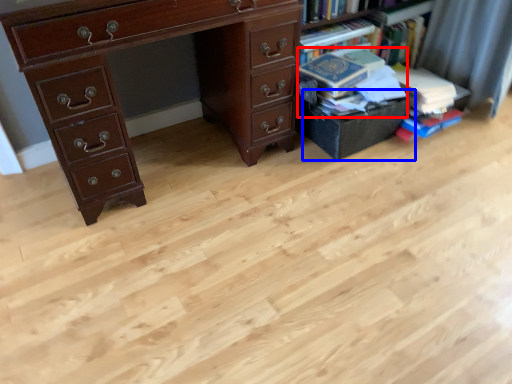
Question: Which of the following is the closest to the observer, book (highlighted by a red box) or drawer (highlighted by a blue box)?

Choices:
 (A) book
 (B) drawer

Answer: (A)